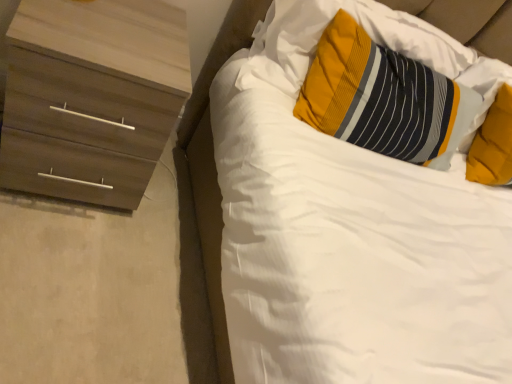
Question: Would you say wooden chest of drawers at left is to the left or to the right of striped fabric pillow at upper right, which appears as the 1th pillow when viewed from the left, in the picture?

Choices:
 (A) left
 (B) right

Answer: (A)

Question: Is wooden chest of drawers at left bigger or smaller than striped fabric pillow at upper right, the second pillow when ordered from right to left?

Choices:
 (A) small
 (B) big

Answer: (B)

Question: Which object is positioned farthest from the striped fabric pillow at upper right, the second pillow when ordered from right to left?

Choices:
 (A) wooden chest of drawers at left
 (B) white soft bed at upper right
 (C) soft yellow pillow at upper right, which appears as the second pillow when viewed from the left

Answer: (A)

Question: Estimate the real-world distances between objects in this image. Which object is closer to the striped fabric pillow at upper right, which appears as the 1th pillow when viewed from the left?

Choices:
 (A) wooden chest of drawers at left
 (B) white soft bed at upper right
 (C) soft yellow pillow at upper right, marked as the first pillow in a right-to-left arrangement

Answer: (C)